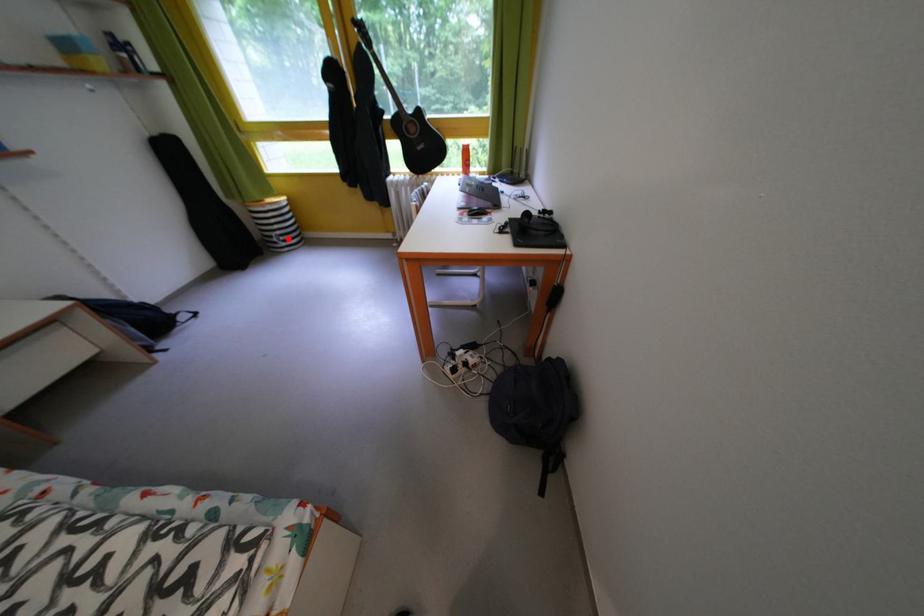
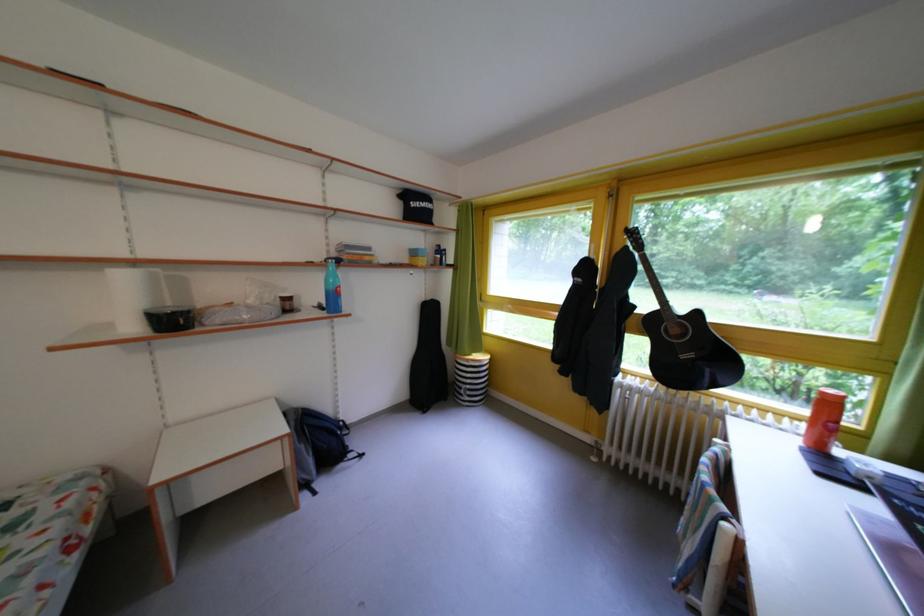
In the second image, find the point that corresponds to the highlighted location in the first image.

(478, 392)